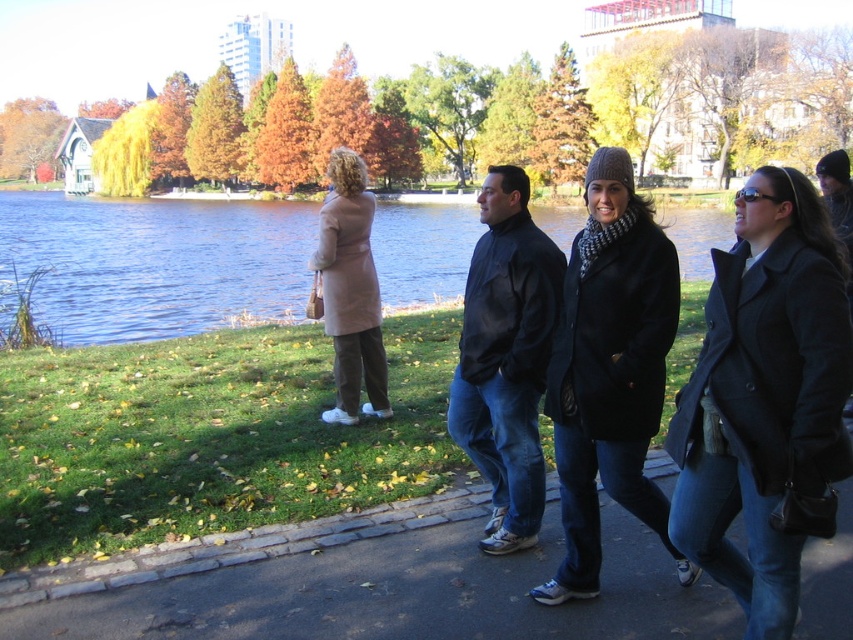
Question: Can you confirm if dark gray asphalt at lower center is positioned below dark gray wool coat at center?

Choices:
 (A) no
 (B) yes

Answer: (B)

Question: Estimate the real-world distances between objects in this image. Which object is farther from the dark blue jacket at center?

Choices:
 (A) dark gray wool coat at center
 (B) dark gray asphalt at lower center

Answer: (A)

Question: Considering the real-world distances, which object is farthest from the dark blue jacket at center?

Choices:
 (A) dark gray wool coat at center
 (B) beige wool coat at center
 (C) dark gray asphalt at lower center
 (D) knit gray hat at center

Answer: (A)

Question: From the image, what is the correct spatial relationship of blue water at center in relation to dark blue jacket at center?

Choices:
 (A) above
 (B) below

Answer: (A)

Question: Observing the image, what is the correct spatial positioning of blue water at center in reference to knit gray hat at center?

Choices:
 (A) below
 (B) above

Answer: (B)

Question: Which point appears closest to the camera in this image?

Choices:
 (A) pyautogui.click(x=595, y=609)
 (B) pyautogui.click(x=361, y=180)
 (C) pyautogui.click(x=531, y=588)

Answer: (A)